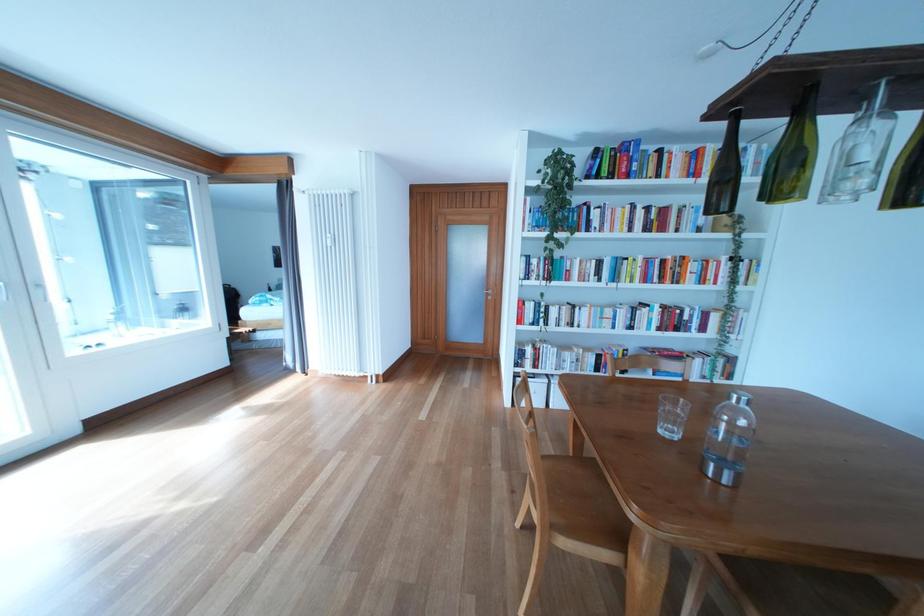
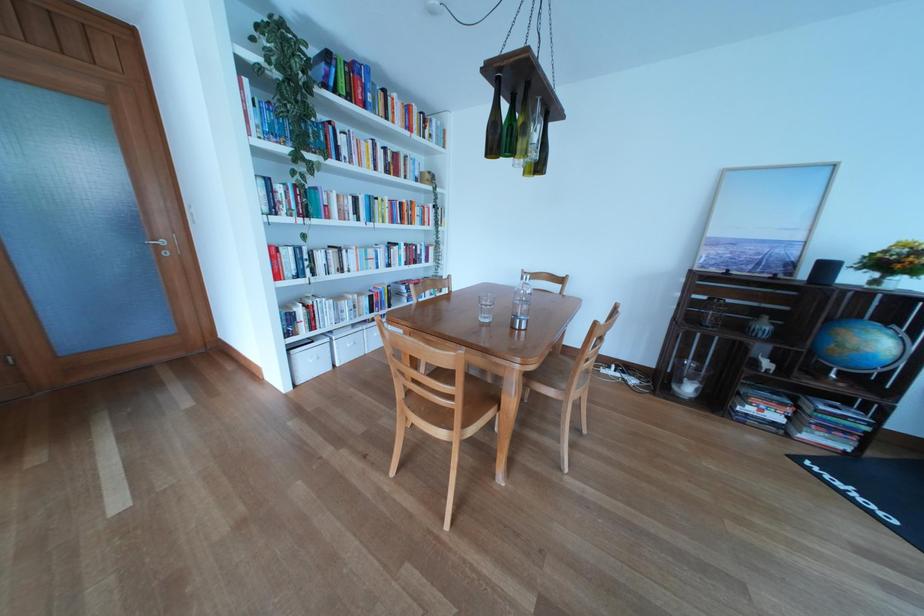
Question: The camera is either moving clockwise (left) or counter-clockwise (right) around the object. The first image is from the beginning of the video and the second image is from the end. Is the camera moving left or right when shooting the video?

Choices:
 (A) Left
 (B) Right

Answer: (A)